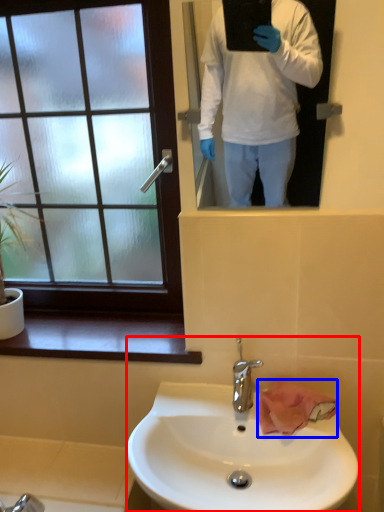
Question: Which point is closer to the camera, sink (highlighted by a red box) or hand towel (highlighted by a blue box)?

Choices:
 (A) sink
 (B) hand towel

Answer: (A)